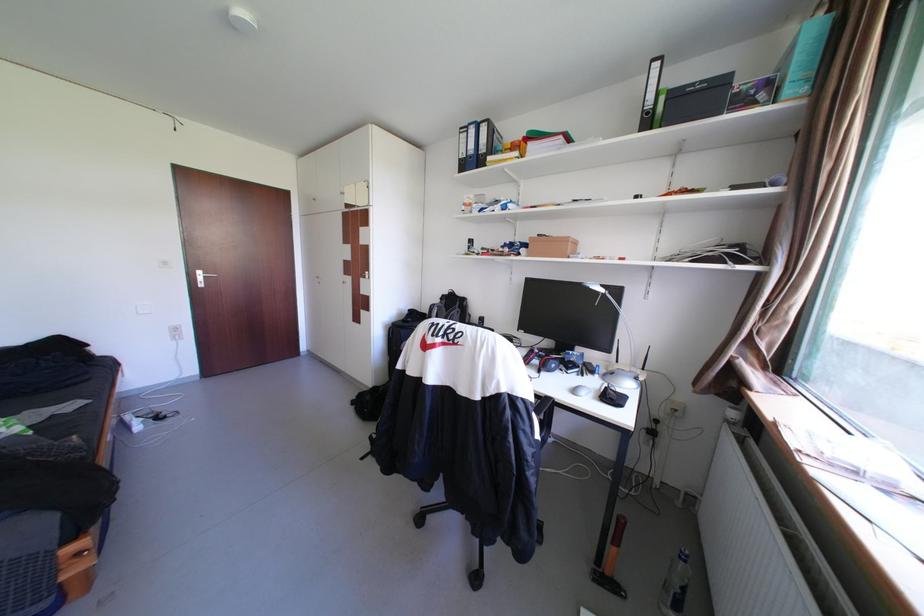
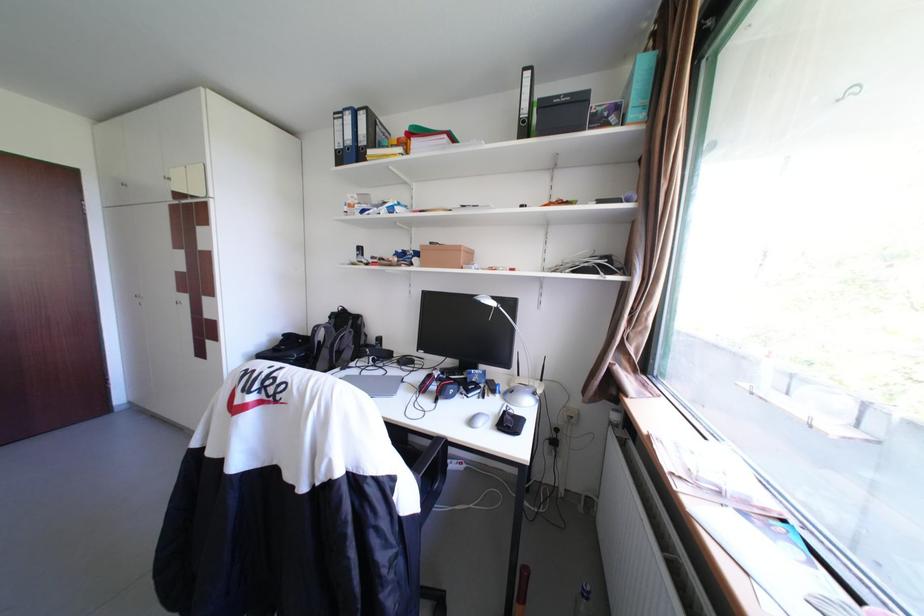
Locate, in the second image, the point that corresponds to (537,361) in the first image.

(433, 389)